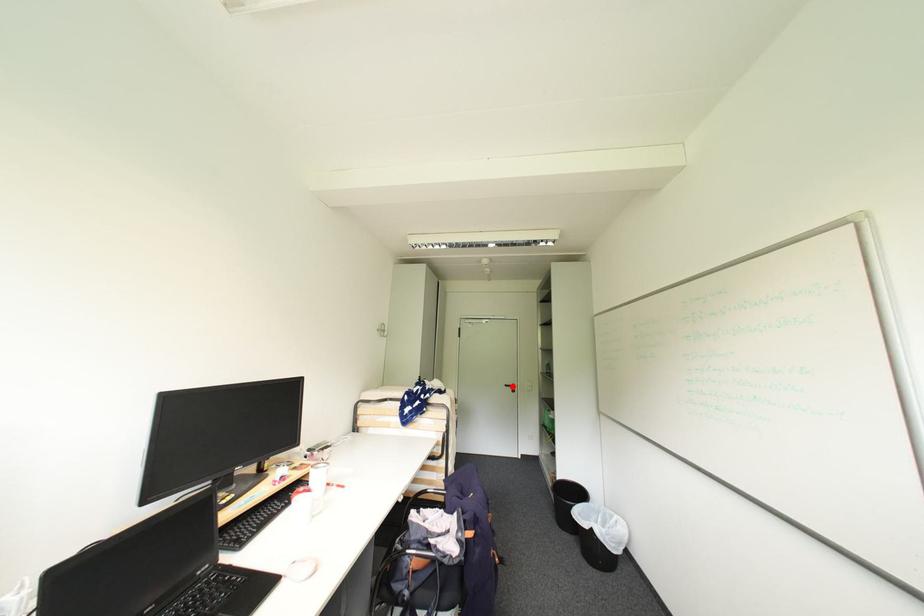
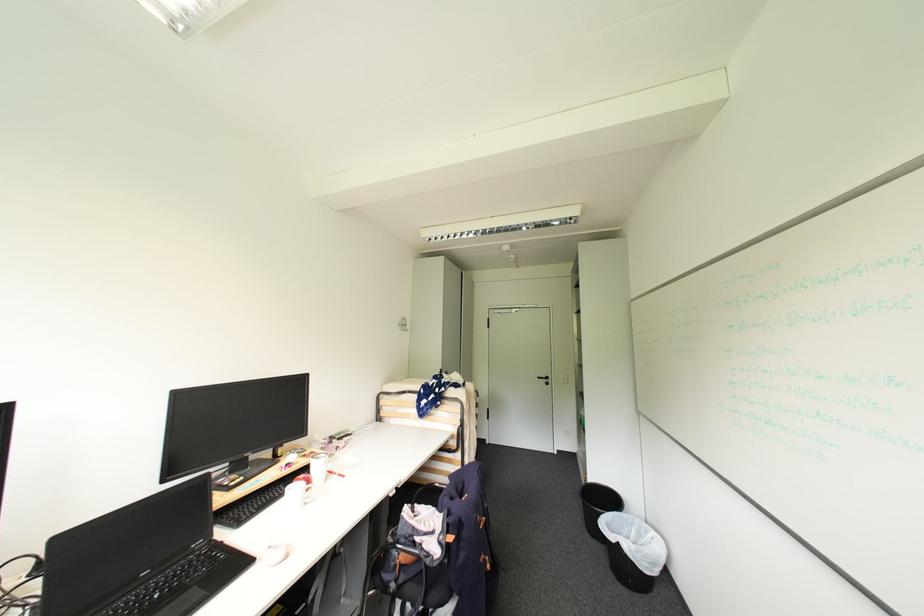
The point at the highlighted location is marked in the first image. Where is the corresponding point in the second image?

(544, 379)